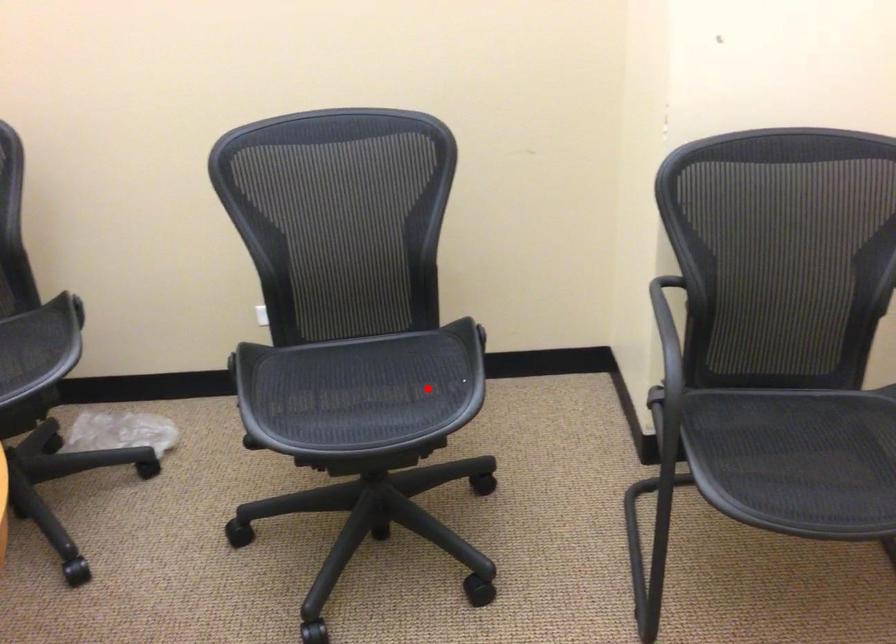
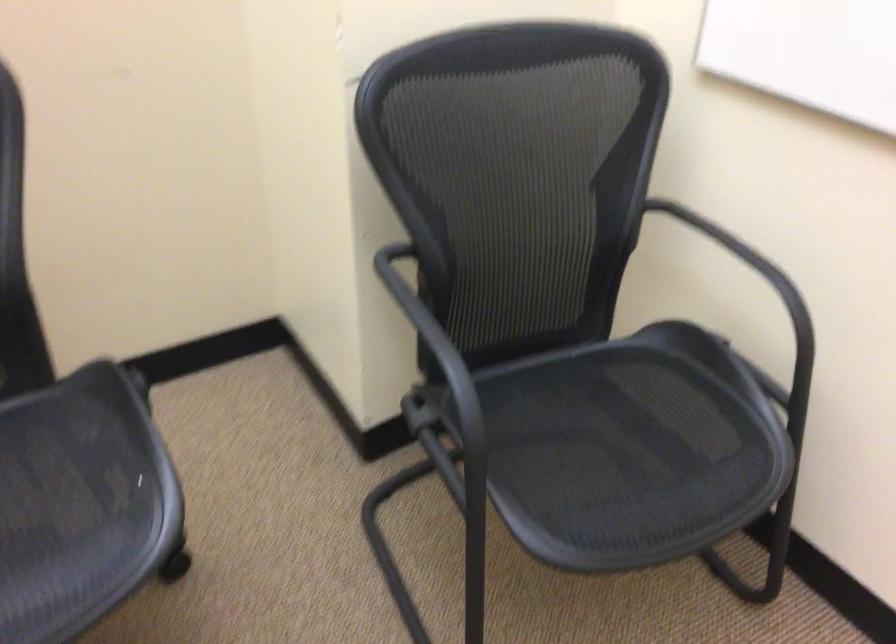
Question: I am providing you with two images of the same scene from different viewpoints. Given a red point in image1, look at the same physical point in image2. Is it:

Choices:
 (A) Closer to the viewpoint
 (B) Farther from the viewpoint

Answer: (A)